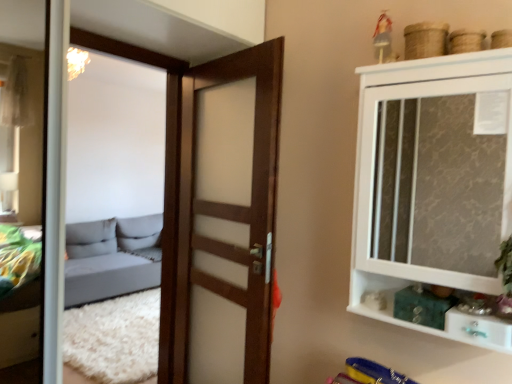
Question: Does point (185, 218) appear closer or farther from the camera than point (470, 331)?

Choices:
 (A) closer
 (B) farther

Answer: (B)

Question: From the image's perspective, is wooden door at center located above or below white glossy cupboard at upper right?

Choices:
 (A) above
 (B) below

Answer: (B)

Question: Which object is the closest to the wooden door at center?

Choices:
 (A) white glossy cupboard at upper right
 (B) white glossy drawer at lower right

Answer: (A)

Question: Which of these objects is positioned farthest from the wooden door at center?

Choices:
 (A) white glossy cupboard at upper right
 (B) white glossy drawer at lower right

Answer: (B)